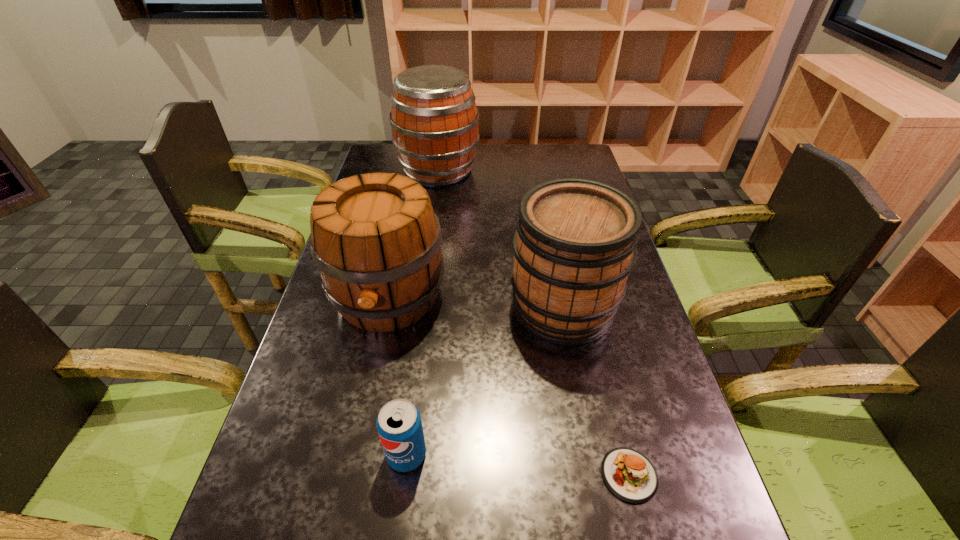
Image resolution: width=960 pixels, height=540 pixels. What are the coordinates of `the farthest object` in the screenshot? It's located at (435, 122).

Image resolution: width=960 pixels, height=540 pixels. Find the location of `the rightmost cider`. the rightmost cider is located at coordinates (575, 244).

This screenshot has width=960, height=540. In order to click on soda can in this screenshot , I will do `click(399, 425)`.

Locate an element on the screen. The image size is (960, 540). the shortest object is located at coordinates (629, 475).

Where is `vacant area located on the left of the farthest object`? vacant area located on the left of the farthest object is located at coordinates pyautogui.click(x=381, y=171).

The image size is (960, 540). I want to click on vacant space located 0.340m on the back of the rightmost cider, so click(543, 204).

Find the location of `vacant region located on the right of the second shortest object`. vacant region located on the right of the second shortest object is located at coordinates (563, 454).

Find the location of `blank space located on the left of the shortest object`. blank space located on the left of the shortest object is located at coordinates (460, 475).

At what (x,y) coordinates should I click in order to perform the action: click on object that is at the far edge. Please return your answer as a coordinate pair (x, y). Image resolution: width=960 pixels, height=540 pixels. Looking at the image, I should click on (435, 122).

Locate an element on the screen. This screenshot has height=540, width=960. cider that is at the right edge is located at coordinates (575, 244).